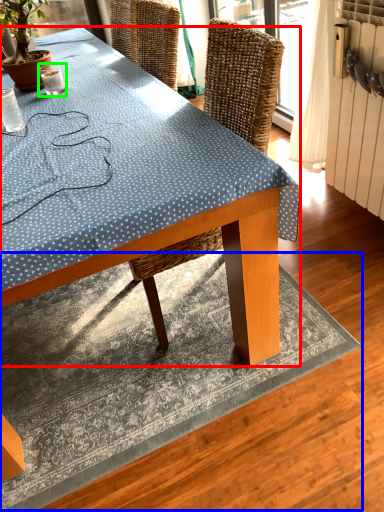
Question: Considering the real-world distances, which object is farthest from desk (highlighted by a red box)? mat (highlighted by a blue box) or coffee cup (highlighted by a green box)?

Choices:
 (A) mat
 (B) coffee cup

Answer: (B)